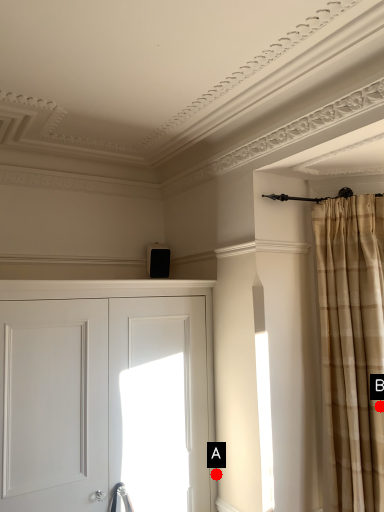
Question: Two points are circled on the image, labeled by A and B beside each circle. Which point is farther from the camera taking this photo?

Choices:
 (A) A is further
 (B) B is further

Answer: (A)